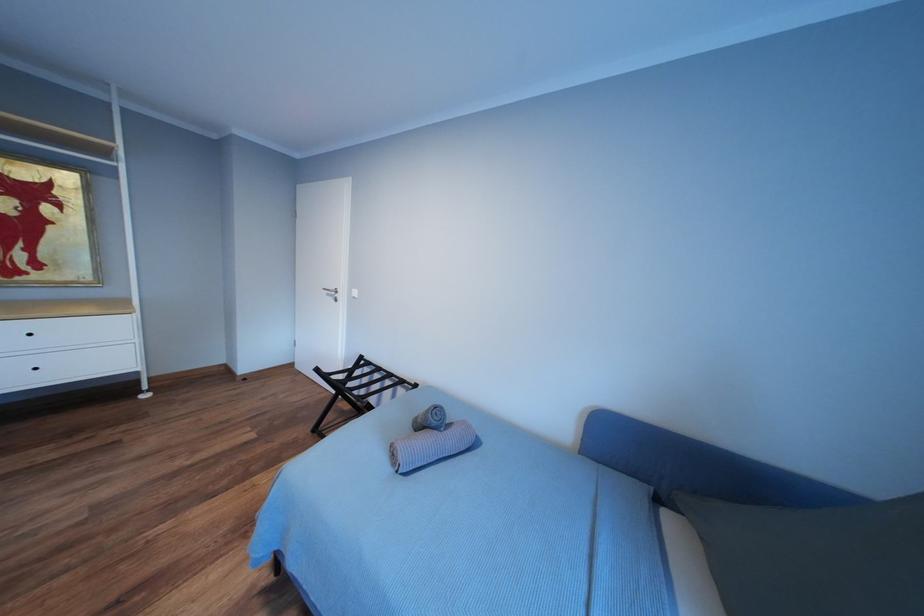
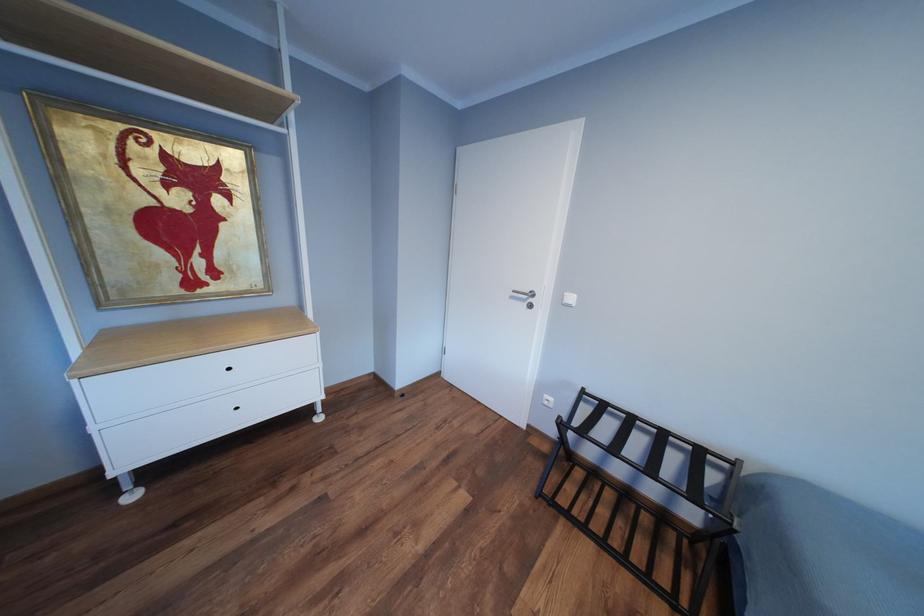
Which direction would the cameraman need to move to produce the second image?

The cameraman walked toward left, forward.